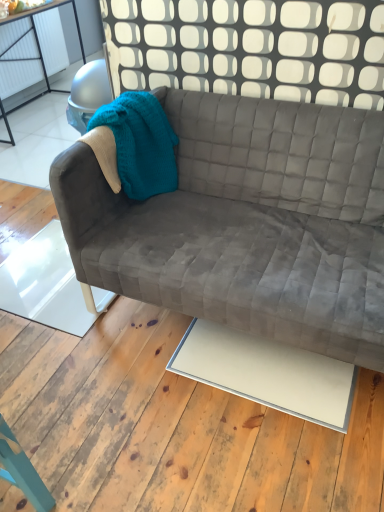
I want to click on white matte plywood at center, so (173, 426).

This screenshot has width=384, height=512. What do you see at coordinates (173, 426) in the screenshot?
I see `white matte plywood at center` at bounding box center [173, 426].

What do you see at coordinates (247, 222) in the screenshot? I see `velvet gray couch at center` at bounding box center [247, 222].

What are the coordinates of `velvet gray couch at center` in the screenshot? It's located at (247, 222).

Find the location of a particular element. The width and height of the screenshot is (384, 512). white matte plywood at center is located at coordinates (173, 426).

Is velvet gray couch at center to the left or to the right of white matte plywood at center in the image?

From the image, it's evident that velvet gray couch at center is to the right of white matte plywood at center.

Is velvet gray couch at center in front of or behind white matte plywood at center in the image?

Visually, velvet gray couch at center is located behind white matte plywood at center.

Which is more distant, (383, 316) or (148, 384)?

Point (148, 384)

From the image's perspective, is velvet gray couch at center positioned above or below white matte plywood at center?

Based on their image positions, velvet gray couch at center is located above white matte plywood at center.

From a real-world perspective, is velvet gray couch at center on white matte plywood at center?

Indeed, from a real-world perspective, velvet gray couch at center stands above white matte plywood at center.

Does velvet gray couch at center have a greater width compared to white matte plywood at center?

No.

Between velvet gray couch at center and white matte plywood at center, which one has less height?

With less height is white matte plywood at center.

Is velvet gray couch at center smaller than white matte plywood at center?

No.

Is velvet gray couch at center outside of white matte plywood at center?

velvet gray couch at center is positioned outside white matte plywood at center.

Is velvet gray couch at center positioned far away from white matte plywood at center?

velvet gray couch at center is actually quite close to white matte plywood at center.

Could you tell me if velvet gray couch at center is turned towards white matte plywood at center?

No, velvet gray couch at center is not facing towards white matte plywood at center.

In the scene shown: What's the angular difference between velvet gray couch at center and white matte plywood at center's facing directions?

The angle between the facing direction of velvet gray couch at center and the facing direction of white matte plywood at center is 90.5 degrees.

Identify the location of plywood that is under the velvet gray couch at center (from a real-world perspective). The width and height of the screenshot is (384, 512). (173, 426).

Visually, is white matte plywood at center positioned to the left or to the right of velvet gray couch at center?

white matte plywood at center is positioned on velvet gray couch at center's left side.

Is white matte plywood at center further to camera compared to velvet gray couch at center?

No, it is not.

Is point (159, 330) behind point (313, 307)?

Yes.

From the image's perspective, is white matte plywood at center over velvet gray couch at center?

No, from the image's perspective, white matte plywood at center is not above velvet gray couch at center.

From a real-world perspective, between white matte plywood at center and velvet gray couch at center, who is vertically higher?

velvet gray couch at center, from a real-world perspective.

Is white matte plywood at center wider than velvet gray couch at center?

Correct, the width of white matte plywood at center exceeds that of velvet gray couch at center.

Consider the image. Considering the sizes of objects white matte plywood at center and velvet gray couch at center in the image provided, who is taller, white matte plywood at center or velvet gray couch at center?

velvet gray couch at center.

Considering the relative sizes of white matte plywood at center and velvet gray couch at center in the image provided, is white matte plywood at center bigger than velvet gray couch at center?

No, white matte plywood at center is not bigger than velvet gray couch at center.

Could velvet gray couch at center be considered to be inside white matte plywood at center?

That's incorrect, velvet gray couch at center is not inside white matte plywood at center.

Consider the image. Is white matte plywood at center far away from velvet gray couch at center?

No, white matte plywood at center is in close proximity to velvet gray couch at center.

Could you tell me if white matte plywood at center is turned towards velvet gray couch at center?

Yes.

Based on the photo, what's the angular difference between white matte plywood at center and velvet gray couch at center's facing directions?

The angle between the facing direction of white matte plywood at center and the facing direction of velvet gray couch at center is 90.5 degrees.

Measure the distance between white matte plywood at center and velvet gray couch at center.

white matte plywood at center and velvet gray couch at center are 17.92 inches apart from each other.

This screenshot has height=512, width=384. In order to click on studio couch located on the right of white matte plywood at center in this screenshot , I will do `click(247, 222)`.

Identify the location of studio couch above the white matte plywood at center (from the image's perspective). This screenshot has width=384, height=512. (247, 222).

The image size is (384, 512). In order to click on plywood located underneath the velvet gray couch at center (from a real-world perspective) in this screenshot , I will do `click(173, 426)`.